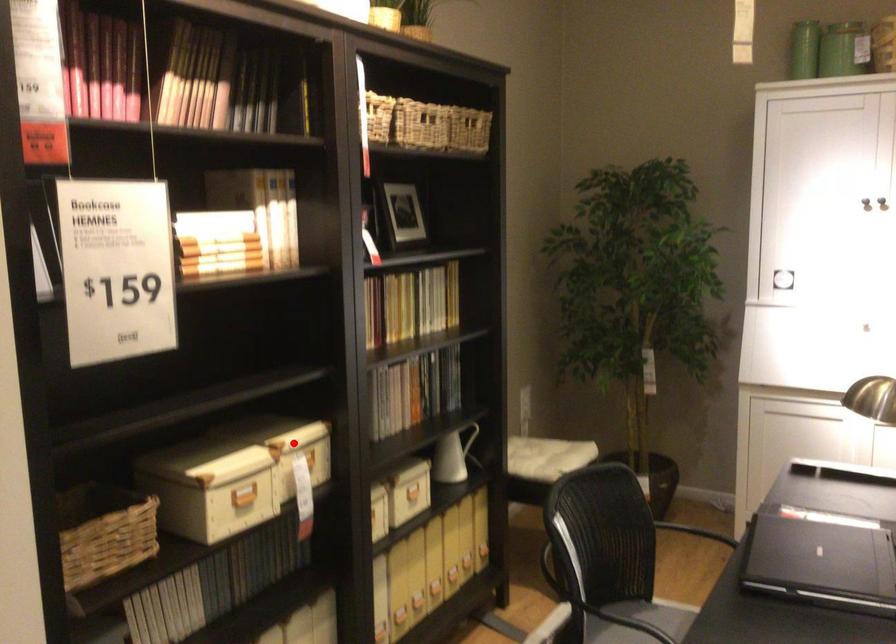
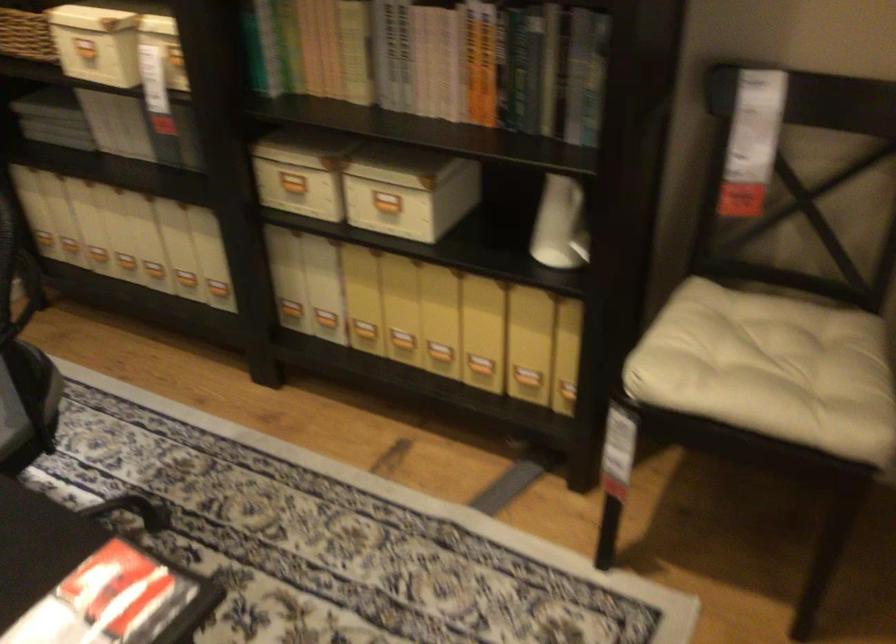
Question: I am providing you with two images of the same scene from different viewpoints. In image1, a red point is highlighted. Considering the same 3D point in image2, which of the following is correct?

Choices:
 (A) It is closer
 (B) It is farther

Answer: (A)